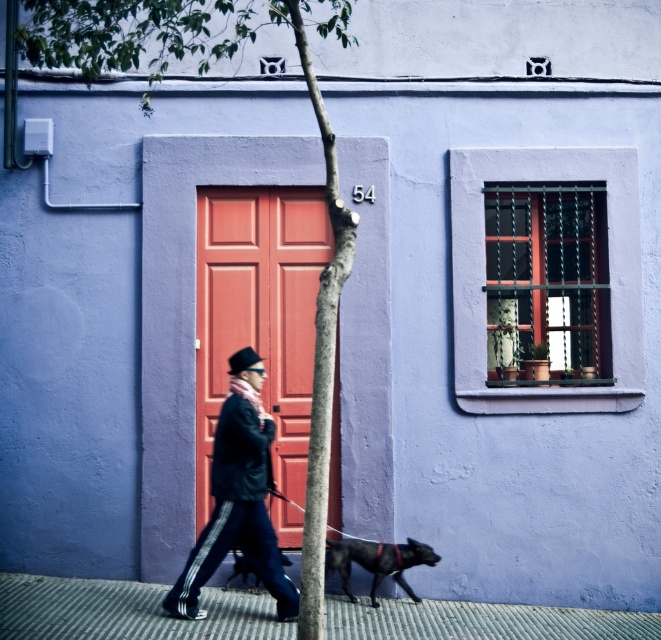
The height and width of the screenshot is (640, 661). I want to click on green textured tree at center, so (x=204, y=72).

Can you confirm if green textured tree at center is positioned to the right of black leather jacket at center?

No, green textured tree at center is not to the right of black leather jacket at center.

Who is more distant from viewer, [91,35] or [235,394]?

Positioned behind is point [235,394].

Find the location of a particular element. green textured tree at center is located at coordinates (204, 72).

Is point (266, 550) positioned before point (241, 566)?

Yes, it is.

Can you confirm if black leather jacket at center is taller than shiny black dog at center?

Correct, black leather jacket at center is much taller as shiny black dog at center.

Between point (266, 426) and point (249, 561), which one is positioned in front?

Positioned in front is point (266, 426).

Where is `black leather jacket at center`? The image size is (661, 640). black leather jacket at center is located at coordinates (239, 497).

Who is positioned more to the left, ribbed concrete pavement at lower center or black leather jacket at center?

ribbed concrete pavement at lower center

Looking at this image, is ribbed concrete pavement at lower center positioned before black leather jacket at center?

Yes.

Is point (329, 628) behind point (215, 556)?

Yes, point (329, 628) is behind point (215, 556).

You are a GUI agent. You are given a task and a screenshot of the screen. Output one action in this format:
    pyautogui.click(x=<x>, y=<y>)
    Task: Click on the ribbed concrete pavement at lower center
    Image resolution: width=661 pixels, height=640 pixels.
    Given the screenshot: What is the action you would take?
    pyautogui.click(x=126, y=611)